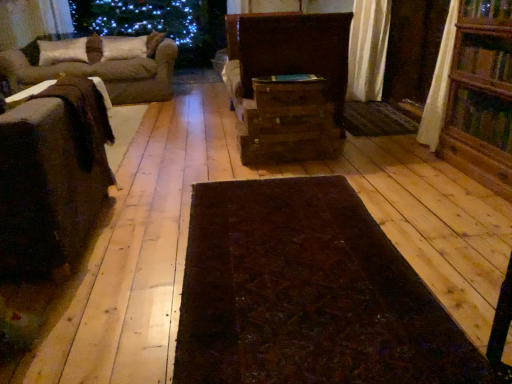
Question: Is wooden table at left in front of wooden chest at center, placed as the first drawer when sorted from top to bottom?

Choices:
 (A) yes
 (B) no

Answer: (A)

Question: Considering the relative sizes of wooden table at left and wooden chest at center, placed as the first drawer when sorted from top to bottom, in the image provided, is wooden table at left shorter than wooden chest at center, placed as the first drawer when sorted from top to bottom,?

Choices:
 (A) no
 (B) yes

Answer: (A)

Question: Does wooden table at left turn towards wooden chest at center, placed as the first drawer when sorted from top to bottom?

Choices:
 (A) no
 (B) yes

Answer: (A)

Question: Is wooden table at left behind wooden chest at center, placed as the first drawer when sorted from top to bottom?

Choices:
 (A) yes
 (B) no

Answer: (B)

Question: Is wooden table at left to the right of wooden chest at center, which ranks as the 3th drawer in bottom-to-top order, from the viewer's perspective?

Choices:
 (A) no
 (B) yes

Answer: (A)

Question: Based on their positions, is dark brown textured mat at center, acting as the second mat starting from the top, located to the left or right of wooden drawer at center, which ranks as the second drawer in bottom-to-top order?

Choices:
 (A) left
 (B) right

Answer: (A)

Question: In the image, is dark brown textured mat at center, which ranks as the 1th mat in left-to-right order, positioned in front of or behind wooden drawer at center, placed as the 2th drawer when sorted from top to bottom?

Choices:
 (A) front
 (B) behind

Answer: (A)

Question: From a real-world perspective, is dark brown textured mat at center, which ranks as the 2th mat in right-to-left order, above or below wooden drawer at center, placed as the 2th drawer when sorted from top to bottom?

Choices:
 (A) below
 (B) above

Answer: (A)

Question: From their relative heights in the image, would you say dark brown textured mat at center, the 1th mat from the bottom, is taller or shorter than wooden drawer at center, which ranks as the second drawer in bottom-to-top order?

Choices:
 (A) tall
 (B) short

Answer: (B)

Question: Is suede-like beige pillow at upper left, the 1th pillow positioned from the right, wider or thinner than wooden drawer at center, placed as the 2th drawer when sorted from top to bottom?

Choices:
 (A) wide
 (B) thin

Answer: (B)

Question: Visually, is suede-like beige pillow at upper left, which is the second pillow in left-to-right order, positioned to the left or to the right of wooden drawer at center, placed as the 2th drawer when sorted from top to bottom?

Choices:
 (A) left
 (B) right

Answer: (A)

Question: Is suede-like beige pillow at upper left, the 1th pillow positioned from the right, bigger or smaller than wooden drawer at center, which ranks as the second drawer in bottom-to-top order?

Choices:
 (A) small
 (B) big

Answer: (B)

Question: Is point (116, 46) positioned closer to the camera than point (251, 132)?

Choices:
 (A) closer
 (B) farther

Answer: (B)

Question: Is wooden bookshelf at right taller or shorter than wooden drawer at center, placed as the 2th drawer when sorted from top to bottom?

Choices:
 (A) tall
 (B) short

Answer: (A)

Question: Considering their positions, is wooden bookshelf at right located in front of or behind wooden drawer at center, which ranks as the second drawer in bottom-to-top order?

Choices:
 (A) behind
 (B) front

Answer: (B)